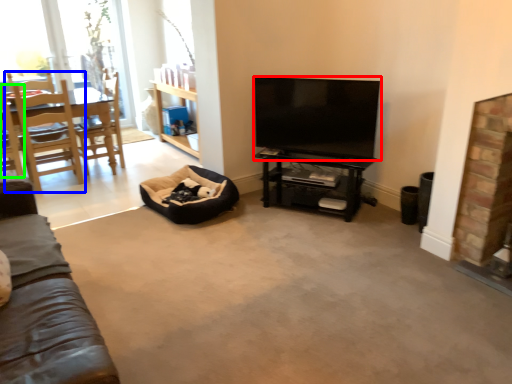
Question: Which is nearer to the television (highlighted by a red box)? chair (highlighted by a blue box) or chair (highlighted by a green box).

Choices:
 (A) chair
 (B) chair

Answer: (A)